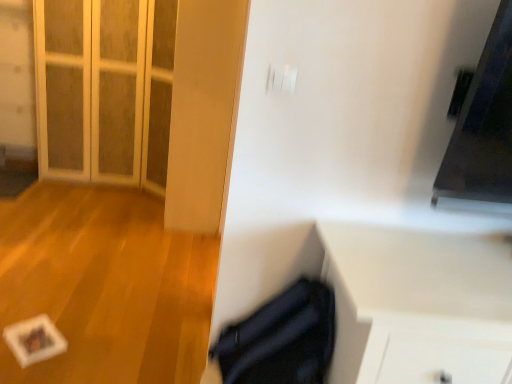
This screenshot has width=512, height=384. What do you see at coordinates (105, 285) in the screenshot? I see `white matte paper at lower left` at bounding box center [105, 285].

I want to click on white glass door at upper left, so click(x=104, y=90).

Where is `white matte cabinet at lower right`? Image resolution: width=512 pixels, height=384 pixels. white matte cabinet at lower right is located at coordinates (417, 305).

How many degrees apart are the facing directions of white matte cabinet at lower right and white matte paper at lower left?

0.418 degrees.

Consider the image. From a real-world perspective, is white matte cabinet at lower right physically located above or below white matte paper at lower left?

In terms of real-world spatial position, white matte cabinet at lower right is above white matte paper at lower left.

Is point (478, 342) positioned before point (46, 244)?

Yes, point (478, 342) is closer to viewer.

From the picture: Who is taller, white glass door at upper left or white matte cabinet at lower right?

white glass door at upper left.

In order to click on cabinetry lying in front of the white glass door at upper left in this screenshot , I will do `click(417, 305)`.

Which is closer, (119, 176) or (344, 373)?

The point (344, 373) is in front.

Would you say white glass door at upper left is inside or outside white matte cabinet at lower right?

white glass door at upper left exists outside the volume of white matte cabinet at lower right.

From a real-world perspective, between white matte paper at lower left and white glass door at upper left, who is vertically higher?

white glass door at upper left is physically above.

From the image's perspective, between white matte paper at lower left and white glass door at upper left, who is located below?

From the image's view, white matte paper at lower left is below.

Can we say white matte paper at lower left lies outside white glass door at upper left?

white matte paper at lower left lies outside white glass door at upper left's area.

Which is behind, white matte cabinet at lower right or white glass door at upper left?

Positioned behind is white glass door at upper left.

From a real-world perspective, is white matte cabinet at lower right above or below white glass door at upper left?

Clearly, from a real-world perspective, white matte cabinet at lower right is below white glass door at upper left.

This screenshot has width=512, height=384. I want to click on cabinetry in front of the white glass door at upper left, so click(x=417, y=305).

Which of these two, white glass door at upper left or white matte paper at lower left, is smaller?

white matte paper at lower left is smaller.

Is white glass door at upper left closer to the viewer compared to white matte paper at lower left?

No, the depth of white glass door at upper left is greater than that of white matte paper at lower left.

Considering the relative sizes of white glass door at upper left and white matte paper at lower left in the image provided, is white glass door at upper left taller than white matte paper at lower left?

Yes, white glass door at upper left is taller than white matte paper at lower left.

Can you confirm if white glass door at upper left is thinner than white matte paper at lower left?

Correct, the width of white glass door at upper left is less than that of white matte paper at lower left.

Which of these two, white matte paper at lower left or white matte cabinet at lower right, is wider?

Wider between the two is white matte paper at lower left.

Would you say white matte paper at lower left is inside or outside white matte cabinet at lower right?

white matte paper at lower left is not enclosed by white matte cabinet at lower right.

Based on the photo, is white matte paper at lower left aimed at white matte cabinet at lower right?

No.

From their relative heights in the image, would you say white matte paper at lower left is taller or shorter than white matte cabinet at lower right?

Clearly, white matte paper at lower left is shorter compared to white matte cabinet at lower right.

Image resolution: width=512 pixels, height=384 pixels. What are the coordinates of `cabinetry below the white matte paper at lower left (from the image's perspective)` in the screenshot? It's located at (417, 305).

Find the location of a particular element. cabinetry to the right of white glass door at upper left is located at coordinates (417, 305).

Looking at the image, which one is located closer to white glass door at upper left, white matte cabinet at lower right or white matte paper at lower left?

white matte paper at lower left is positioned closer to the anchor white glass door at upper left.

When comparing their distances from white glass door at upper left, does white matte paper at lower left or white matte cabinet at lower right seem further?

white matte cabinet at lower right is positioned further to the anchor white glass door at upper left.

Looking at the image, which one is located closer to white matte cabinet at lower right, white glass door at upper left or white matte paper at lower left?

white matte paper at lower left lies closer to white matte cabinet at lower right than the other object.

When comparing their distances from white matte paper at lower left, does white matte cabinet at lower right or white glass door at upper left seem further?

white matte cabinet at lower right.

Looking at the image, which one is located closer to white matte cabinet at lower right, white matte paper at lower left or white glass door at upper left?

The object closer to white matte cabinet at lower right is white matte paper at lower left.

Looking at the image, which one is located further to white matte paper at lower left, white glass door at upper left or white matte cabinet at lower right?

Based on the image, white matte cabinet at lower right appears to be further to white matte paper at lower left.

Image resolution: width=512 pixels, height=384 pixels. I want to click on plain between white matte cabinet at lower right and white glass door at upper left from front to back, so click(105, 285).